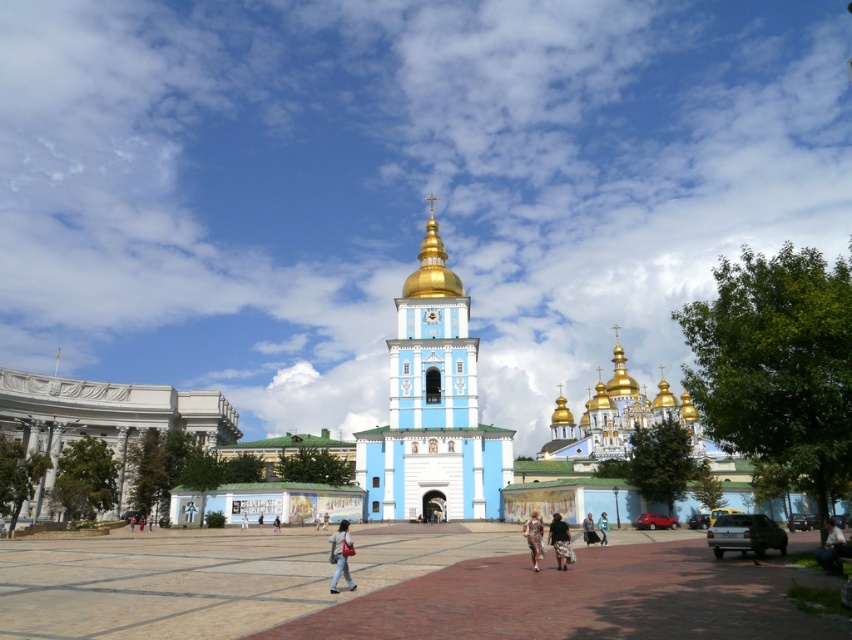
Between point (511, 467) and point (836, 545), which one is positioned behind?

The point (511, 467) is behind.

Consider the image. Is blue painted stone tower at center closer to camera compared to light blue jeans at lower right?

No.

Between point (389, 410) and point (827, 561), which one is positioned behind?

Positioned behind is point (389, 410).

At what (x,y) coordinates should I click in order to perform the action: click on blue painted stone tower at center. Please return your answer as a coordinate pair (x, y). This screenshot has width=852, height=640. Looking at the image, I should click on (433, 408).

Can you confirm if floral dress at center is positioned below dark gray fabric pants at center?

No.

Is floral dress at center to the right of dark gray fabric pants at center from the viewer's perspective?

Incorrect, floral dress at center is not on the right side of dark gray fabric pants at center.

This screenshot has height=640, width=852. What are the coordinates of `floral dress at center` in the screenshot? It's located at (533, 538).

Where is `blue painted stone tower at center`? blue painted stone tower at center is located at coordinates (433, 408).

Does point (463, 474) lie behind point (107, 412)?

That is False.

The image size is (852, 640). Find the location of `blue painted stone tower at center`. blue painted stone tower at center is located at coordinates (433, 408).